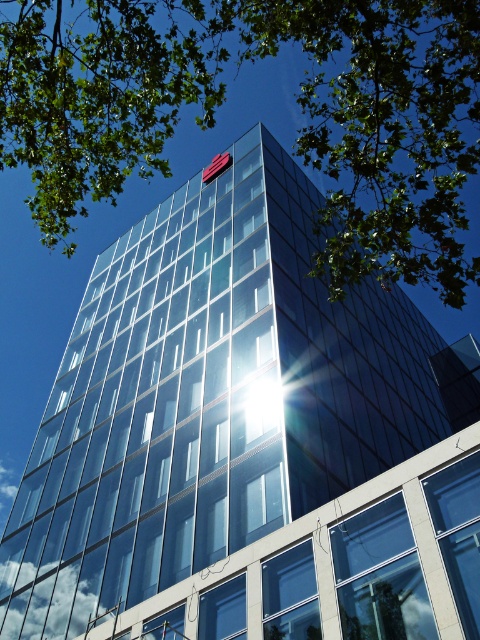
Can you confirm if green leafy tree at upper left is thinner than red fabric flag at upper center?

Incorrect, green leafy tree at upper left's width is not less than red fabric flag at upper center's.

Does green leafy tree at upper left appear on the left side of red fabric flag at upper center?

Incorrect, green leafy tree at upper left is not on the left side of red fabric flag at upper center.

I want to click on green leafy tree at upper left, so click(224, 99).